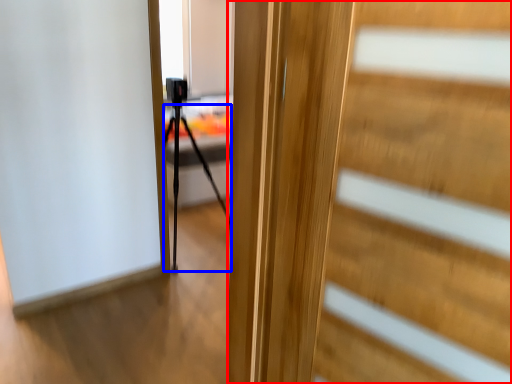
Question: Which of the following is the farthest to the observer, door (highlighted by a red box) or tripod (highlighted by a blue box)?

Choices:
 (A) door
 (B) tripod

Answer: (B)